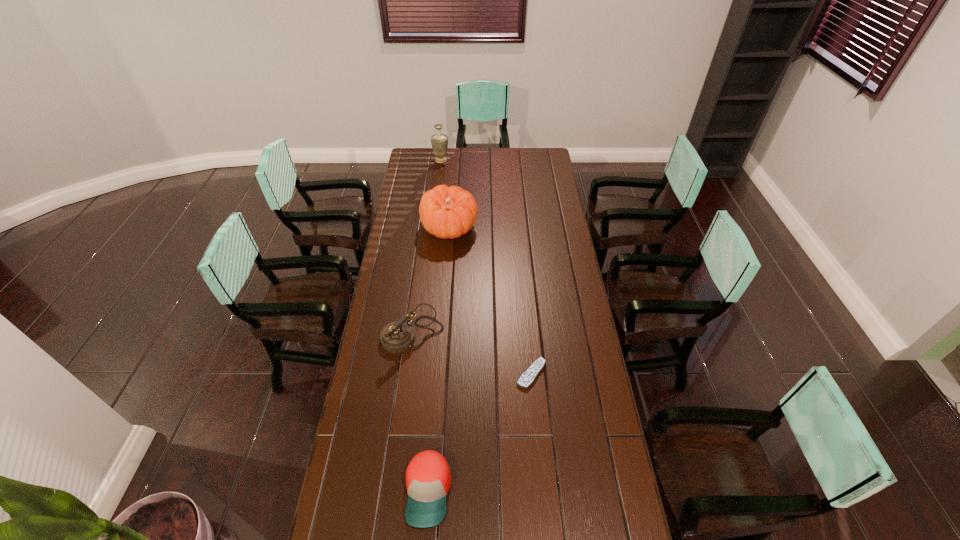
In the image, there is a desktop. Where is `vacant space at the far left corner`? vacant space at the far left corner is located at coordinates (426, 166).

Find the location of a particular element. The height and width of the screenshot is (540, 960). vacant space at the far right corner of the desktop is located at coordinates (x=543, y=168).

At what (x,y) coordinates should I click in order to perform the action: click on free space that is in between the telephone and the baseball cap. Please return your answer as a coordinate pair (x, y). Looking at the image, I should click on (420, 414).

At what (x,y) coordinates should I click in order to perform the action: click on free spot between the rightmost object and the third shortest object. Please return your answer as a coordinate pair (x, y). Image resolution: width=960 pixels, height=540 pixels. Looking at the image, I should click on (472, 355).

I want to click on empty space between the third nearest object and the fourth nearest object, so click(431, 282).

Find the location of a particular element. free spot between the third nearest object and the nearest object is located at coordinates (420, 414).

At what (x,y) coordinates should I click in order to perform the action: click on free space that is in between the farthest object and the second shortest object. Please return your answer as a coordinate pair (x, y). The image size is (960, 540). Looking at the image, I should click on (435, 326).

At what (x,y) coordinates should I click in order to perform the action: click on free spot between the remote control and the fourth nearest object. Please return your answer as a coordinate pair (x, y). Image resolution: width=960 pixels, height=540 pixels. Looking at the image, I should click on (491, 301).

Select which object appears as the fourth closest to the second shortest object. Please provide its 2D coordinates. Your answer should be formatted as a tuple, i.e. [(x, y)], where the tuple contains the x and y coordinates of a point satisfying the conditions above.

[(439, 141)]

The height and width of the screenshot is (540, 960). Identify the location of object that is the fourth nearest to the telephone. (439, 141).